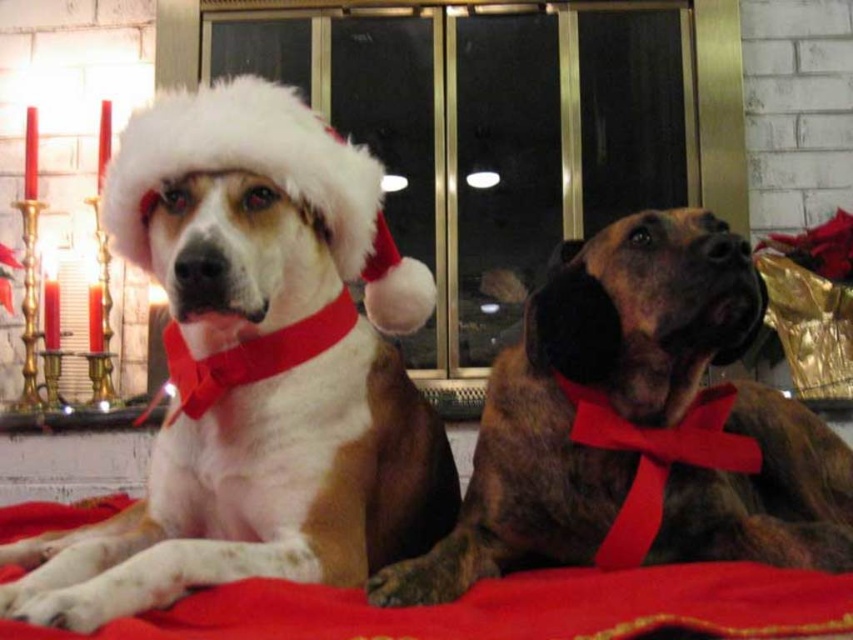
Question: In this image, where is braun leather dog at center located relative to white fluffy santa hat at upper left?

Choices:
 (A) above
 (B) below

Answer: (B)

Question: Is red fabric blanket at lower center smaller than white fluffy santa hat at upper left?

Choices:
 (A) yes
 (B) no

Answer: (A)

Question: Can you confirm if braun leather dog at center is positioned to the right of red fabric blanket at lower center?

Choices:
 (A) no
 (B) yes

Answer: (B)

Question: Which is farther from the white fur dog at center?

Choices:
 (A) red fabric blanket at lower center
 (B) braun leather dog at center

Answer: (B)

Question: Estimate the real-world distances between objects in this image. Which object is farther from the white fluffy santa hat at upper left?

Choices:
 (A) red fabric blanket at lower center
 (B) braun leather dog at center

Answer: (A)

Question: Estimate the real-world distances between objects in this image. Which object is farther from the braun leather dog at center?

Choices:
 (A) red fabric blanket at lower center
 (B) white fluffy santa hat at upper left

Answer: (B)